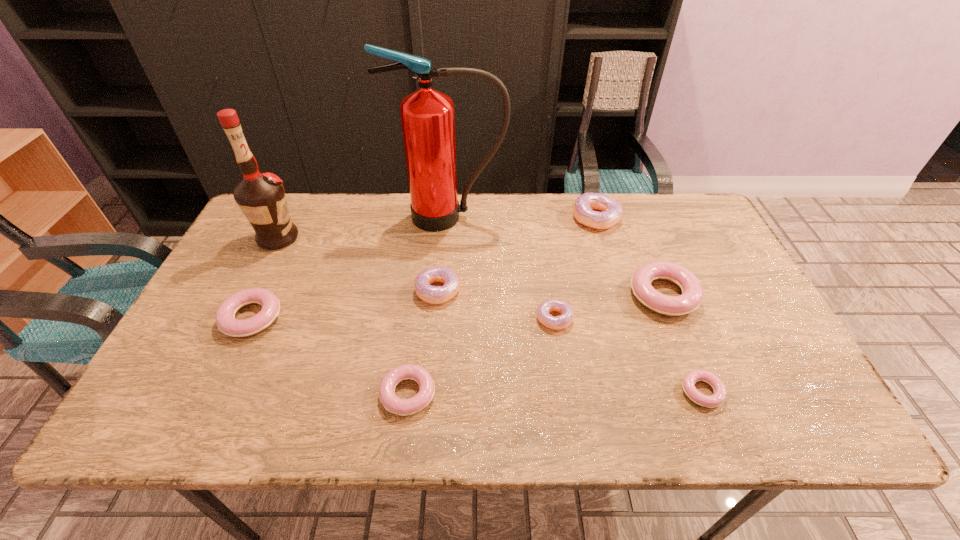
Identify the location of purple doughnut that is the third closest to the liquor. This screenshot has width=960, height=540. (584, 205).

Where is `pink doughnut that is the closest to the third biggest pink doughnut`? pink doughnut that is the closest to the third biggest pink doughnut is located at coordinates (225, 316).

This screenshot has height=540, width=960. In order to click on the closest pink doughnut to the farthest purple doughnut in this screenshot , I will do `click(692, 292)`.

The height and width of the screenshot is (540, 960). I want to click on vacant position in the image that satisfies the following two spatial constraints: 1. on the front side of the second biggest pink doughnut; 2. on the left side of the fourth doughnut from left to right, so [x=252, y=318].

Locate an element on the screen. The image size is (960, 540). free space that satisfies the following two spatial constraints: 1. on the front and back of the liquor; 2. on the back side of the shortest object is located at coordinates (201, 392).

Find the location of a particular element. free location that satisfies the following two spatial constraints: 1. on the back side of the biggest pink doughnut; 2. on the right side of the fourth doughnut from right to left is located at coordinates (551, 295).

The height and width of the screenshot is (540, 960). I want to click on vacant space that satisfies the following two spatial constraints: 1. on the back side of the fourth object from right to left; 2. on the right side of the rightmost purple doughnut, so click(539, 218).

Identify the location of free space that satisfies the following two spatial constraints: 1. on the front side of the shortest object; 2. on the left side of the fire extinguisher. The width and height of the screenshot is (960, 540). (435, 392).